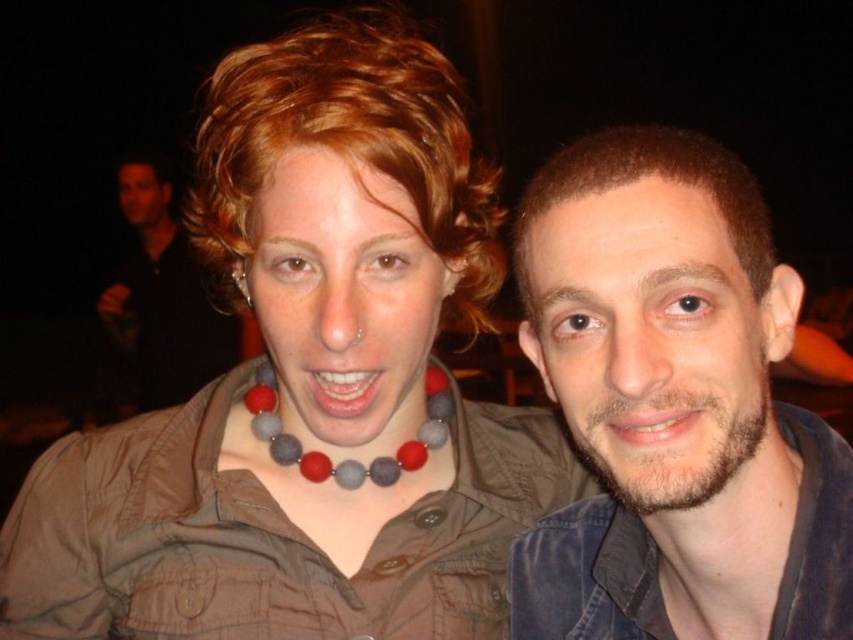
Does smooth skin mouth at center have a larger size compared to silver metallic earring at upper left?

Incorrect, smooth skin mouth at center is not larger than silver metallic earring at upper left.

Can you confirm if smooth skin mouth at center is taller than silver metallic earring at upper left?

No, smooth skin mouth at center is not taller than silver metallic earring at upper left.

Which is in front, point (650, 419) or point (242, 272)?

Point (650, 419) is more forward.

Where is `smooth skin mouth at center`? The width and height of the screenshot is (853, 640). smooth skin mouth at center is located at coordinates (648, 420).

Does multicolored beaded necklace at center have a lesser width compared to smooth skin mouth at center?

No, multicolored beaded necklace at center is not thinner than smooth skin mouth at center.

Which is behind, point (410, 337) or point (634, 438)?

Positioned behind is point (410, 337).

Identify the location of multicolored beaded necklace at center. (344, 300).

This screenshot has height=640, width=853. What do you see at coordinates (672, 403) in the screenshot? I see `denim jacket at right` at bounding box center [672, 403].

Which is below, denim jacket at right or brown matte hair at center?

denim jacket at right

You are a GUI agent. You are given a task and a screenshot of the screen. Output one action in this format:
    pyautogui.click(x=<x>, y=<y>)
    Task: Click on the denim jacket at right
    The image size is (853, 640).
    Given the screenshot: What is the action you would take?
    point(672,403)